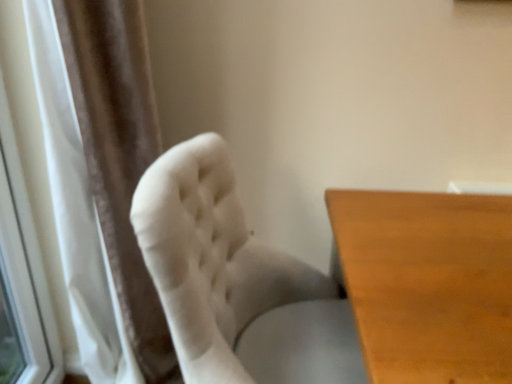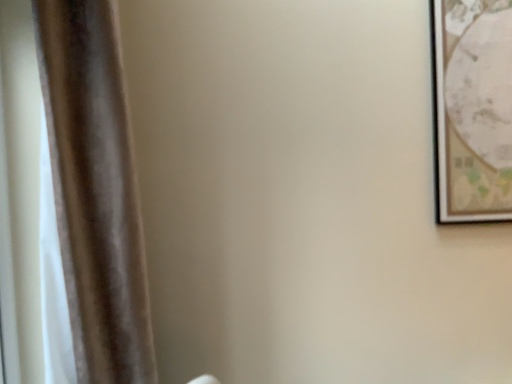
Question: Which way did the camera rotate in the video?

Choices:
 (A) rotated upward
 (B) rotated downward

Answer: (A)